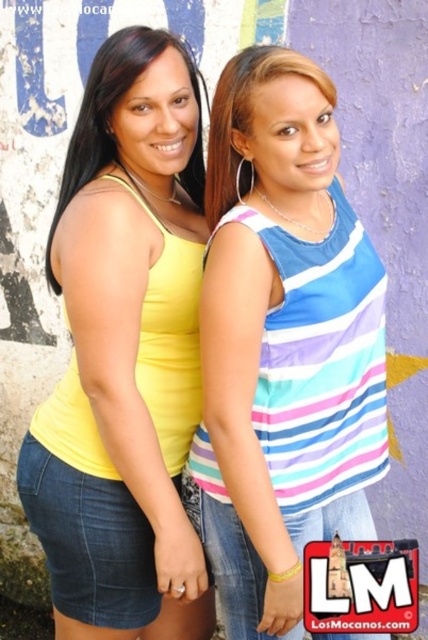
From the picture: Does striped fabric tank top at center have a larger size compared to yellow matte tank top at left?

No, striped fabric tank top at center is not bigger than yellow matte tank top at left.

Can you confirm if striped fabric tank top at center is positioned to the left of yellow matte tank top at left?

In fact, striped fabric tank top at center is to the right of yellow matte tank top at left.

Is point (222, 532) behind point (100, 340)?

Yes.

Where is `striped fabric tank top at center`? striped fabric tank top at center is located at coordinates (284, 342).

Measure the distance between point [172,61] and camera.

Result: 1.71 meters

Does yellow matte tank top at left have a greater width compared to matte blue tank top at center?

Indeed, yellow matte tank top at left has a greater width compared to matte blue tank top at center.

Does point (92, 234) lie in front of point (252, 168)?

That is True.

This screenshot has width=428, height=640. Identify the location of yellow matte tank top at left. pos(122,355).

Does yellow matte tank top at left appear under matte yellow tank top at left?

Indeed, yellow matte tank top at left is positioned under matte yellow tank top at left.

The width and height of the screenshot is (428, 640). What do you see at coordinates (122, 355) in the screenshot? I see `yellow matte tank top at left` at bounding box center [122, 355].

You are a GUI agent. You are given a task and a screenshot of the screen. Output one action in this format:
    pyautogui.click(x=<x>, y=<y>)
    Task: Click on the yellow matte tank top at left
    
    Given the screenshot: What is the action you would take?
    pyautogui.click(x=122, y=355)